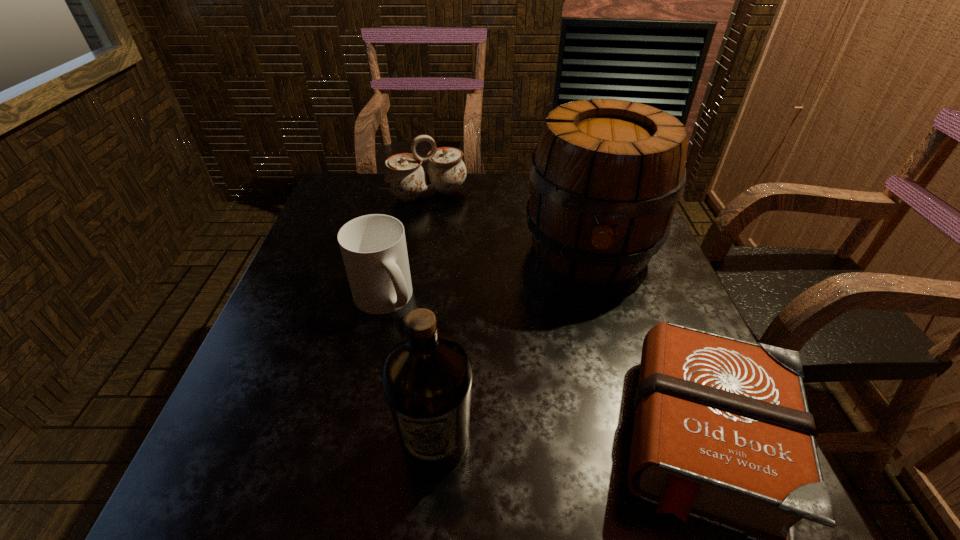
You are a GUI agent. You are given a task and a screenshot of the screen. Output one action in this format:
    pyautogui.click(x=<x>, y=<y>)
    Task: Click on the vacant space located 0.290m on the side of the cider where the spigot is located
    
    Given the screenshot: What is the action you would take?
    pyautogui.click(x=592, y=414)

Identify the location of free point located 0.160m on the side of the cider where the spigot is located. The image size is (960, 540). (591, 356).

Identify the location of vacant region located on the side of the cider where the spigot is located. (592, 364).

This screenshot has width=960, height=540. Find the location of `chinaware located at the far edge`. chinaware located at the far edge is located at coordinates (405, 178).

At what (x,y) coordinates should I click in order to perform the action: click on cider that is at the far edge. Please return your answer as a coordinate pair (x, y). Image resolution: width=960 pixels, height=540 pixels. Looking at the image, I should click on (606, 176).

What are the coordinates of `object that is at the near edge` in the screenshot? It's located at (427, 376).

You are a GUI agent. You are given a task and a screenshot of the screen. Output one action in this format:
    pyautogui.click(x=<x>, y=<y>)
    Task: Click on the object situated at the left edge
    The height and width of the screenshot is (540, 960).
    Given the screenshot: What is the action you would take?
    pyautogui.click(x=373, y=247)

I want to click on object present at the right edge, so click(606, 176).

Locate an element on the screen. This screenshot has height=540, width=960. object present at the far right corner is located at coordinates (606, 176).

Locate an element on the screen. The width and height of the screenshot is (960, 540). vacant region at the far edge of the desktop is located at coordinates (434, 214).